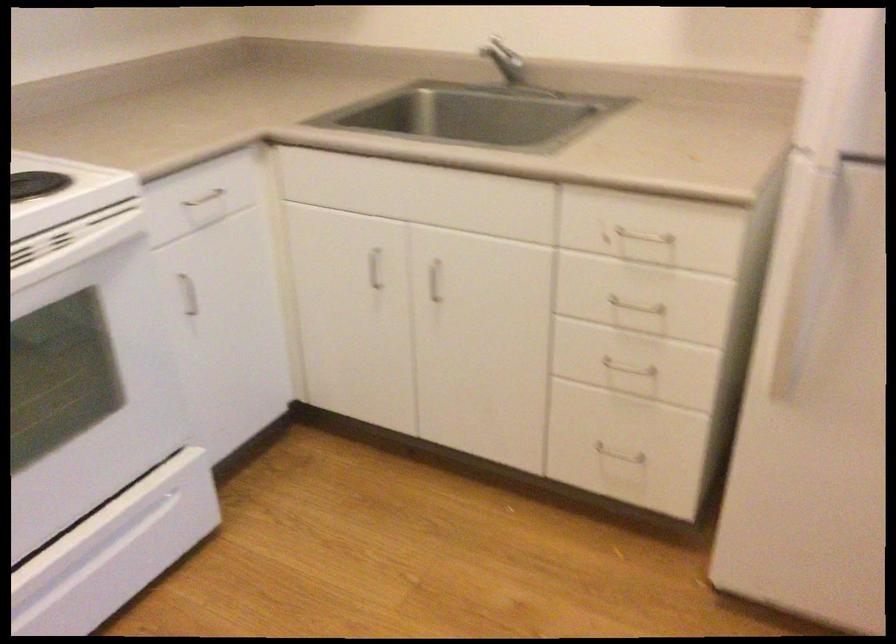
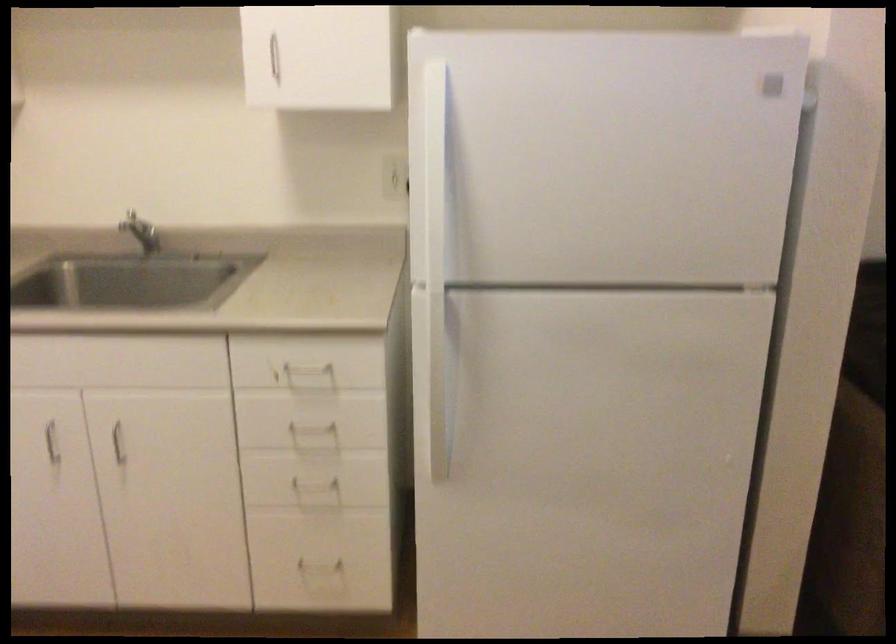
Locate, in the second image, the point that corresponds to [627,373] in the first image.

(319, 486)